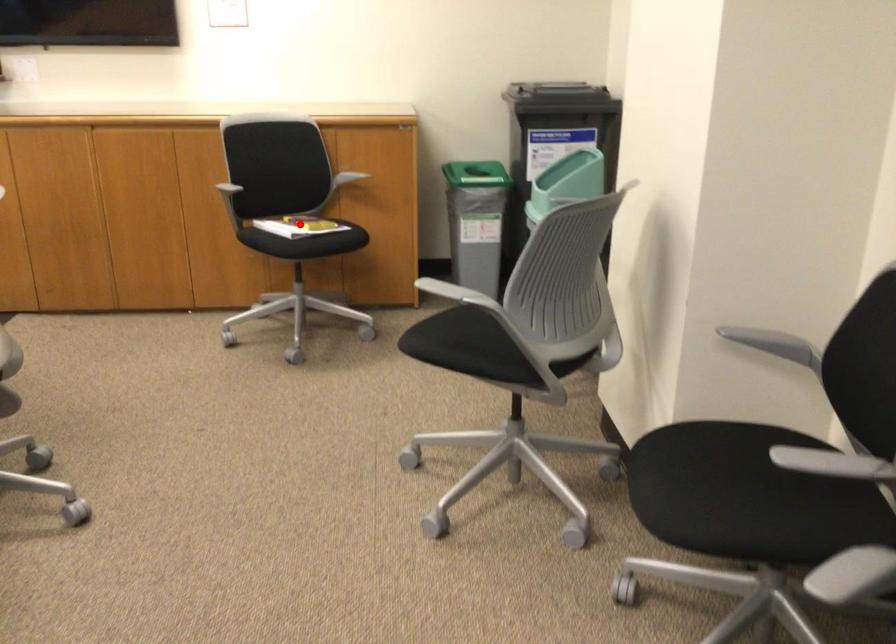
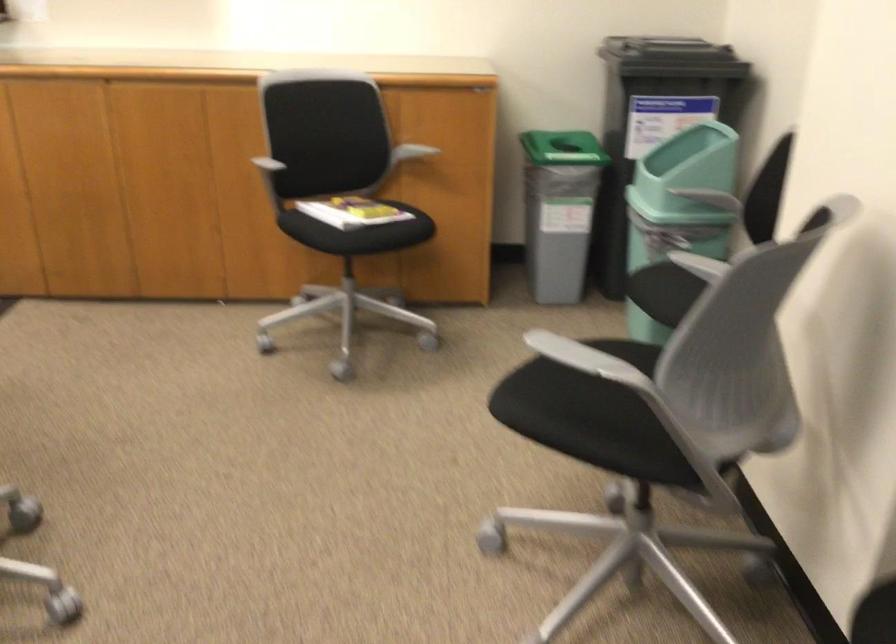
Where in the second image is the point corresponding to the highlighted location from the first image?

(351, 211)